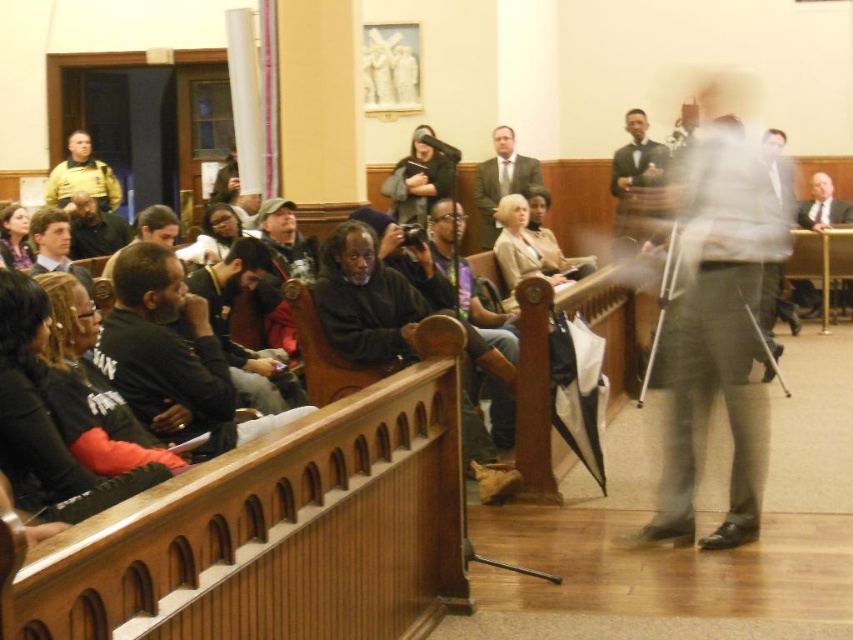
Find the location of a particular element. Image resolution: width=853 pixels, height=640 pixels. matte gray suit at center is located at coordinates (502, 180).

What do you see at coordinates (502, 180) in the screenshot?
I see `matte gray suit at center` at bounding box center [502, 180].

Image resolution: width=853 pixels, height=640 pixels. Describe the element at coordinates (502, 180) in the screenshot. I see `matte gray suit at center` at that location.

Find the location of a particular element. The width and height of the screenshot is (853, 640). matte gray suit at center is located at coordinates (502, 180).

Is point (403, 177) in front of point (511, 129)?

No, (403, 177) is behind (511, 129).

Who is positioned more to the left, dark gray hoodie at center or matte gray suit at center?

dark gray hoodie at center is more to the left.

Which is behind, point (404, 220) or point (502, 144)?

The point (404, 220) is more distant.

Locate an element on the screen. dark gray hoodie at center is located at coordinates (421, 177).

Is dark gray hoodie at center to the right of yellow uniform at left from the viewer's perspective?

Correct, you'll find dark gray hoodie at center to the right of yellow uniform at left.

Is point (425, 138) positioned behind point (96, 192)?

No, it is not.

Identify the location of dark gray hoodie at center. The image size is (853, 640). (421, 177).